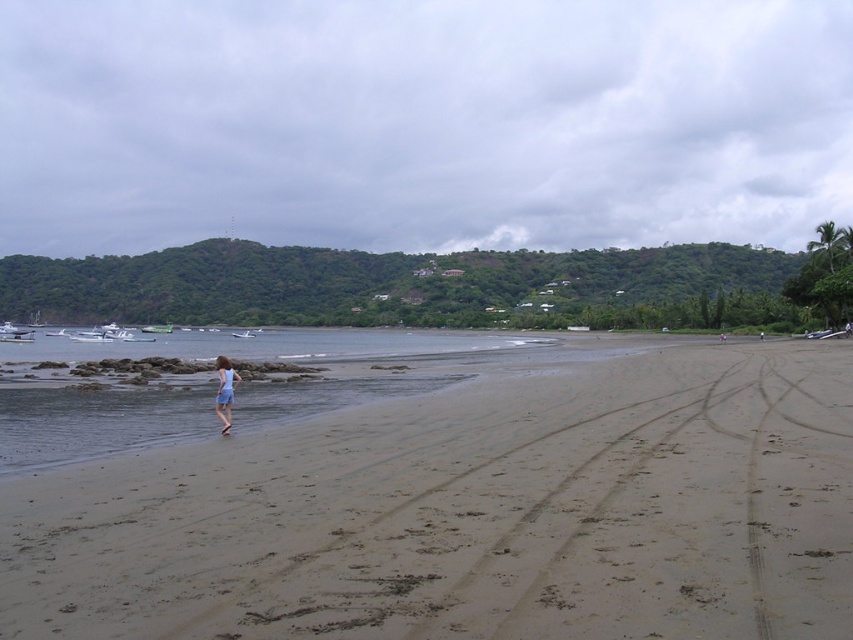
Is sandy beach at lower left wider than light blue fabric dress at center?

Correct, the width of sandy beach at lower left exceeds that of light blue fabric dress at center.

Can you confirm if sandy beach at lower left is smaller than light blue fabric dress at center?

Incorrect, sandy beach at lower left is not smaller in size than light blue fabric dress at center.

Between point (756, 368) and point (219, 419), which one is positioned behind?

Point (756, 368)

Find the location of a particular element. The width and height of the screenshot is (853, 640). sandy beach at lower left is located at coordinates (471, 515).